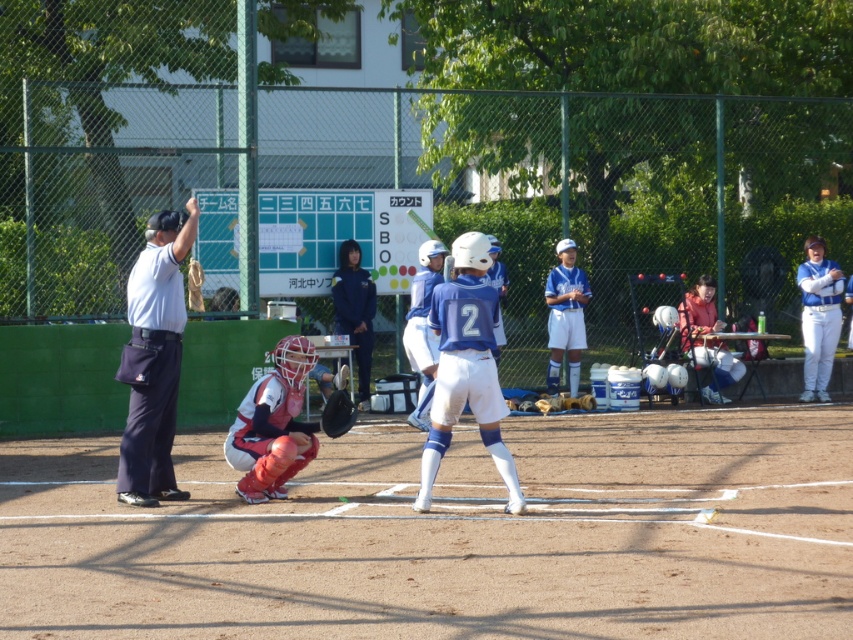
Question: Can you confirm if matte red catcher at center is positioned to the left of white uniform at center?

Choices:
 (A) no
 (B) yes

Answer: (B)

Question: Which object appears farthest from the camera in this image?

Choices:
 (A) blue fabric uniform at center
 (B) black leather baseball glove at center

Answer: (B)

Question: Is dark blue uniform at left smaller than white uniform at center?

Choices:
 (A) yes
 (B) no

Answer: (B)

Question: Which object appears farthest from the camera in this image?

Choices:
 (A) blue fabric uniform at center
 (B) dark blue uniform at left
 (C) blue uniform at center
 (D) matte red catcher at center

Answer: (D)

Question: Is blue uniform at center below black leather baseball glove at center?

Choices:
 (A) no
 (B) yes

Answer: (A)

Question: Among these points, which one is farthest from the camera?

Choices:
 (A) (473, 282)
 (B) (344, 413)
 (C) (267, 490)

Answer: (B)